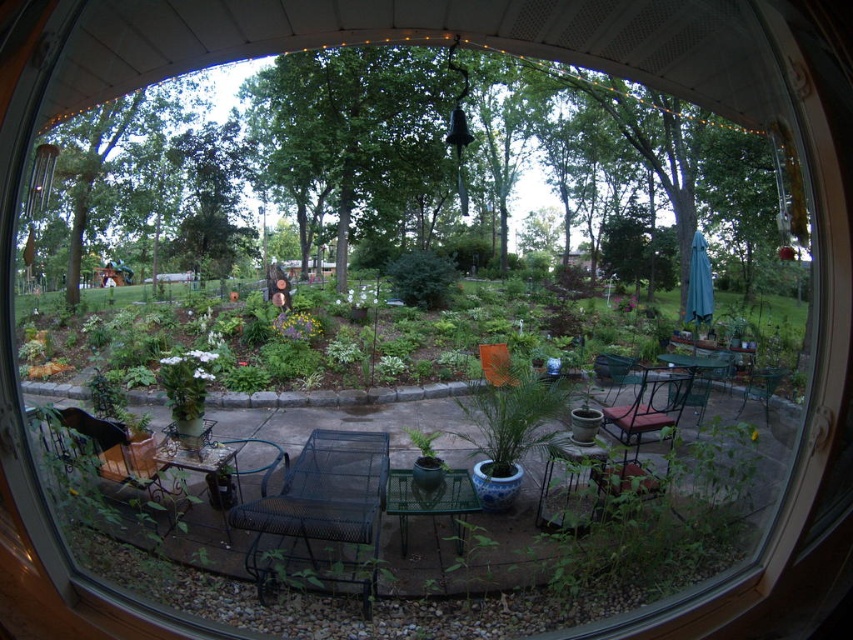
Which is above, green leafy plants at center or metallic green chair at center-right?

Positioned higher is green leafy plants at center.

From the picture: Is green leafy plants at center wider than metallic green chair at center-right?

Indeed, green leafy plants at center has a greater width compared to metallic green chair at center-right.

Identify the location of green leafy plants at center. The height and width of the screenshot is (640, 853). (416, 342).

In order to click on green leafy plants at center in this screenshot , I will do `click(416, 342)`.

Which of these two, green leafy plants at center or metallic brown chair at center-right, stands shorter?

metallic brown chair at center-right

Locate an element on the screen. This screenshot has height=640, width=853. green leafy plants at center is located at coordinates (416, 342).

Locate an element on the screen. The height and width of the screenshot is (640, 853). green leafy plants at center is located at coordinates (416, 342).

From the picture: Does blue glazed pot at center lie in front of metallic brown chair at center-right?

Yes, it is.

Between point (546, 400) and point (616, 426), which one is positioned in front?

Point (546, 400)

I want to click on blue glazed pot at center, so click(x=512, y=416).